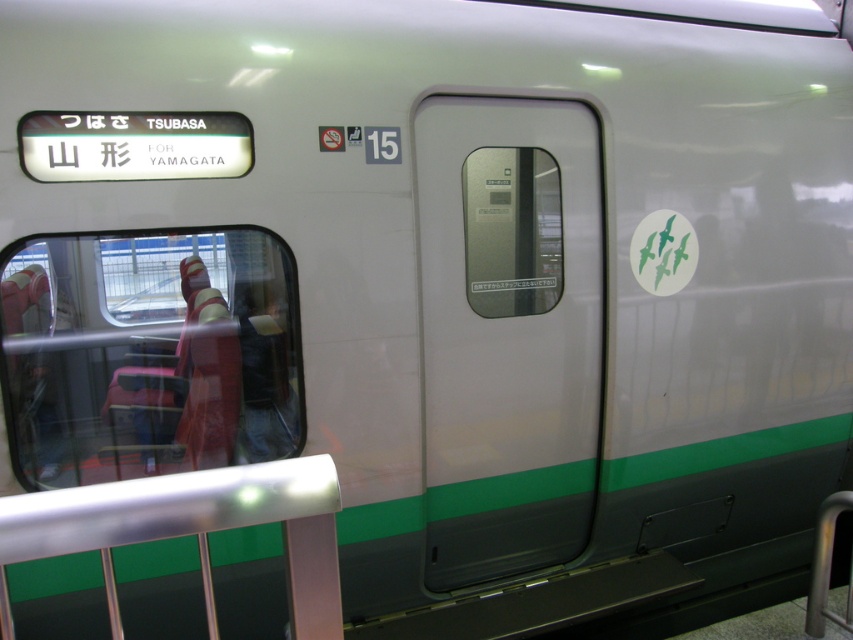
Question: In this image, where is metallic silver rail at lower left located relative to denim pants at left?

Choices:
 (A) right
 (B) left

Answer: (A)

Question: Based on their relative distances, which object is nearer to the denim pants at left?

Choices:
 (A) matte white door at center
 (B) metallic silver rail at lower left

Answer: (A)

Question: Which point is closer to the camera taking this photo?

Choices:
 (A) (277, 400)
 (B) (538, 118)

Answer: (A)

Question: Based on their relative distances, which object is farther from the denim pants at left?

Choices:
 (A) matte white door at center
 (B) metallic silver rail at lower left

Answer: (B)

Question: Can you confirm if matte white door at center is positioned below denim pants at left?

Choices:
 (A) yes
 (B) no

Answer: (B)

Question: Is matte white door at center to the left of metallic silver rail at lower left from the viewer's perspective?

Choices:
 (A) yes
 (B) no

Answer: (B)